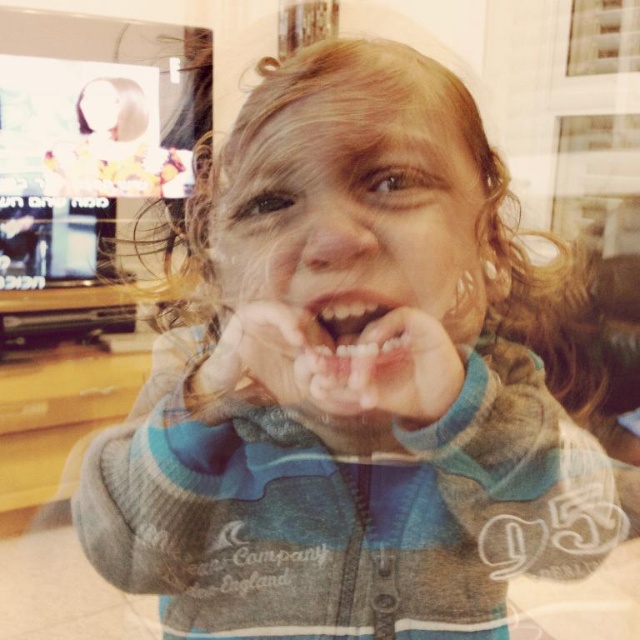
Question: Based on their relative distances, which object is farther from the white matte teeth at center?

Choices:
 (A) smooth pink lips at center
 (B) matte skin hand at center

Answer: (B)

Question: Among these points, which one is farthest from the camera?

Choices:
 (A) (314, 358)
 (B) (214, 397)
 (C) (269, 221)

Answer: (B)

Question: Does smooth skin face at center have a greater width compared to matte skin hand at center?

Choices:
 (A) yes
 (B) no

Answer: (A)

Question: Is white matte teeth at center in front of smooth pink lips at center?

Choices:
 (A) yes
 (B) no

Answer: (A)

Question: Considering the real-world distances, which object is farthest from the smooth pink lips at center?

Choices:
 (A) matte skin hand at center
 (B) smooth skin face at center

Answer: (B)

Question: Does smooth skin face at center have a greater width compared to matte skin hand at center?

Choices:
 (A) yes
 (B) no

Answer: (A)